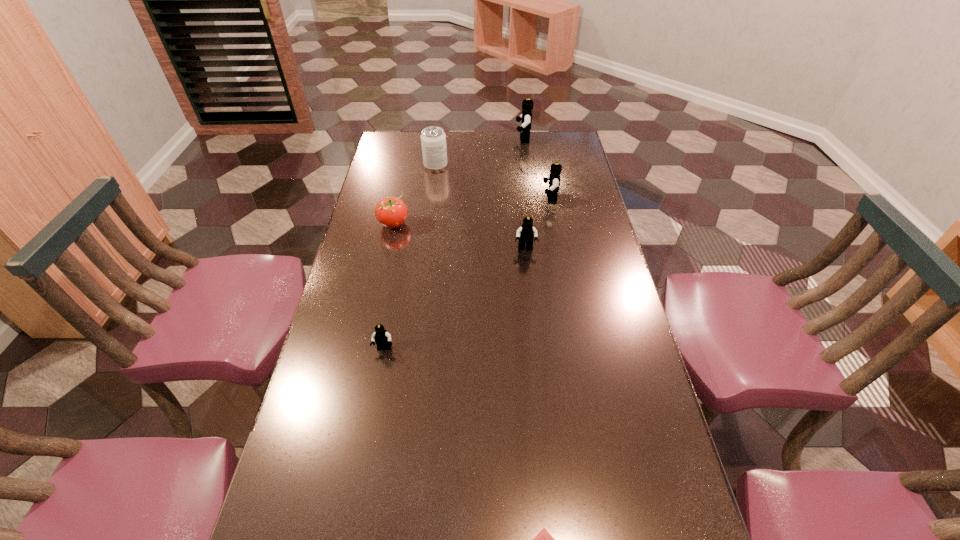
I want to click on vacant space positioned 0.210m on the front-facing side of the fourth tallest Lego, so click(369, 431).

In order to click on Lego present at the far edge in this screenshot , I will do `click(527, 105)`.

At what (x,y) coordinates should I click in order to perform the action: click on soda can positioned at the far edge. Please return your answer as a coordinate pair (x, y). The height and width of the screenshot is (540, 960). Looking at the image, I should click on (433, 139).

The height and width of the screenshot is (540, 960). I want to click on tomato positioned at the left edge, so click(x=391, y=212).

This screenshot has width=960, height=540. Find the location of `Lego at the left edge`. Lego at the left edge is located at coordinates (382, 338).

Image resolution: width=960 pixels, height=540 pixels. Find the location of `object at the right edge`. object at the right edge is located at coordinates (554, 178).

Where is `vacant region at the far edge of the desktop`? vacant region at the far edge of the desktop is located at coordinates (484, 131).

This screenshot has height=540, width=960. I want to click on free spot at the left edge of the desktop, so click(x=306, y=477).

Where is `vacant space at the right edge of the desktop`? This screenshot has height=540, width=960. vacant space at the right edge of the desktop is located at coordinates (588, 302).

This screenshot has height=540, width=960. I want to click on blank space at the far left corner of the desktop, so click(x=388, y=138).